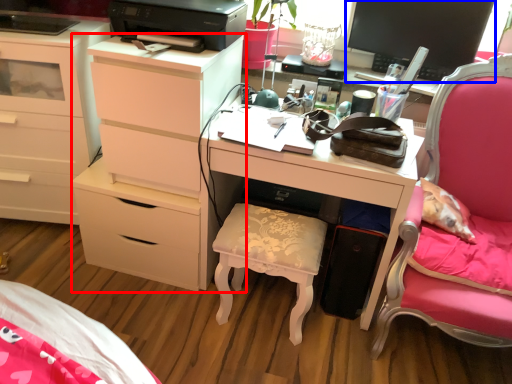
Question: Among these objects, which one is farthest to the camera, chest of drawers (highlighted by a red box) or computer monitor (highlighted by a blue box)?

Choices:
 (A) chest of drawers
 (B) computer monitor

Answer: (A)